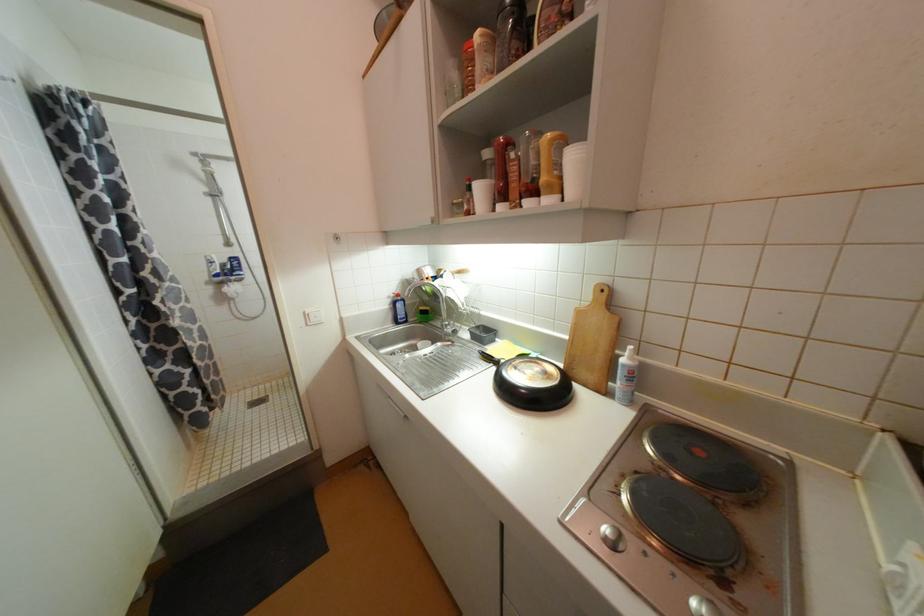
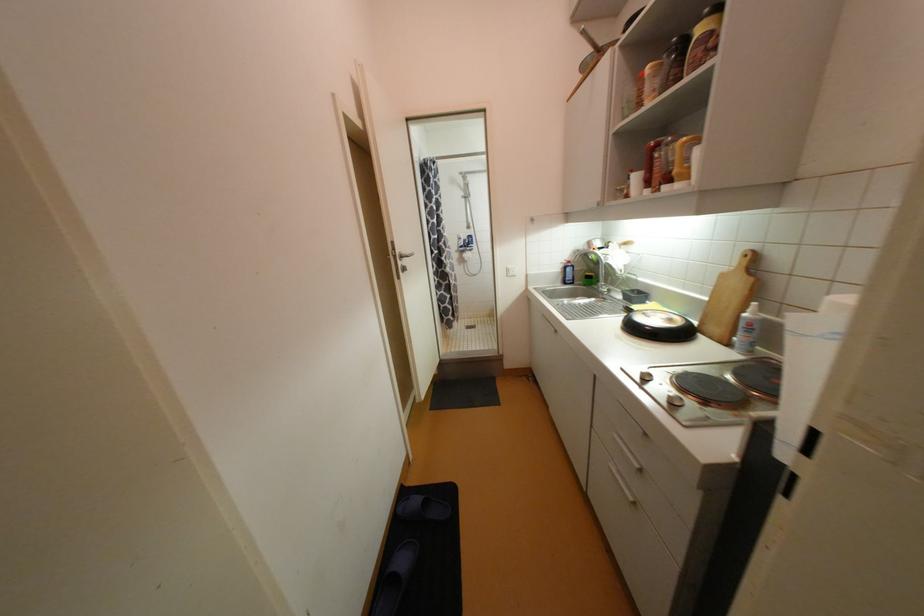
Find the pixel in the second image that matches (518,46) in the first image.

(678, 71)